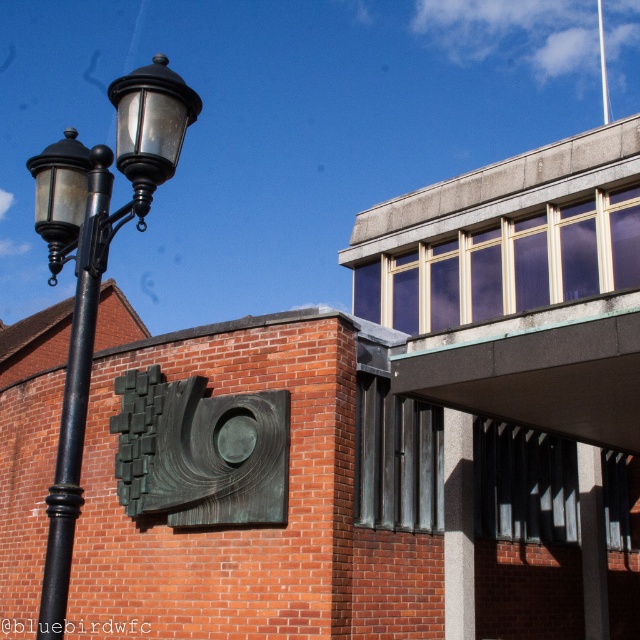
Consider the image. You are a maintenance worker needing to replace a part on the black metal streetlight at left and the black metal pole at left. You have a 16 inch long tool. Can you reach both objects with your tool without moving it?

The black metal streetlight at left and black metal pole at left are 18.15 inches apart. Since the tool is only 16 inches long, it cannot span the distance between them. You will need a longer tool to reach both objects.

You are standing at the center of the image and want to locate the black metal streetlight at left. Which direction should you look to find it?

The black metal streetlight at left is located at point (97, 266), so you should look to the left and slightly downward from the center to find it.